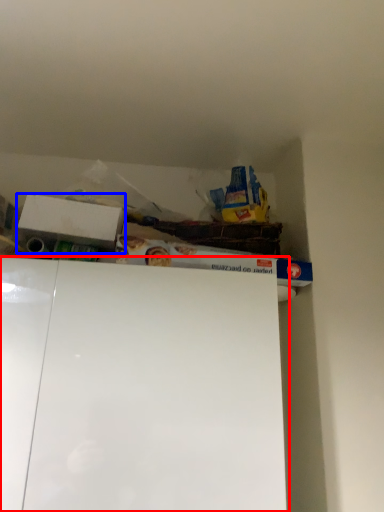
Question: Which of the following is the closest to the observer, cabinet (highlighted by a red box) or box (highlighted by a blue box)?

Choices:
 (A) cabinet
 (B) box

Answer: (A)